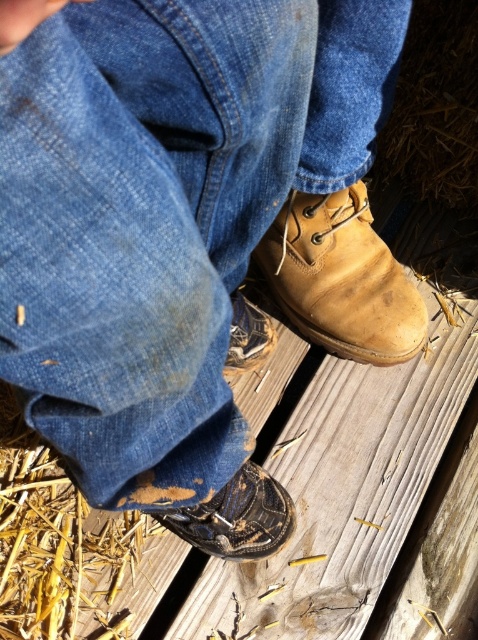
Question: Which point is closer to the camera?

Choices:
 (A) leather boot at lower center
 (B) leather boot at center
 (C) brown leather shoe at lower center

Answer: (A)

Question: Does leather boot at center have a larger size compared to leather boot at lower center?

Choices:
 (A) no
 (B) yes

Answer: (B)

Question: Can you confirm if leather boot at center is positioned below brown leather shoe at lower center?

Choices:
 (A) yes
 (B) no

Answer: (B)

Question: Which object appears closest to the camera in this image?

Choices:
 (A) brown leather shoe at lower center
 (B) leather boot at center

Answer: (B)

Question: Does leather boot at center lie behind brown leather shoe at lower center?

Choices:
 (A) yes
 (B) no

Answer: (B)

Question: Which object is the farthest from the leather boot at center?

Choices:
 (A) leather boot at lower center
 (B) brown leather shoe at lower center

Answer: (A)